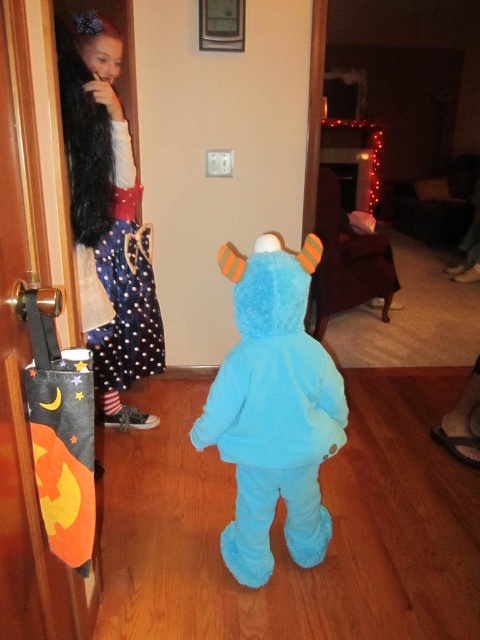
Between fuzzy blue costume at center and polka dot fabric dress at upper left, which one has less height?

fuzzy blue costume at center is shorter.

Can you confirm if fuzzy blue costume at center is shorter than polka dot fabric dress at upper left?

Yes, fuzzy blue costume at center is shorter than polka dot fabric dress at upper left.

Does point (228, 392) come in front of point (73, 141)?

Yes, it is.

Identify the location of fuzzy blue costume at center. This screenshot has width=480, height=640. (274, 410).